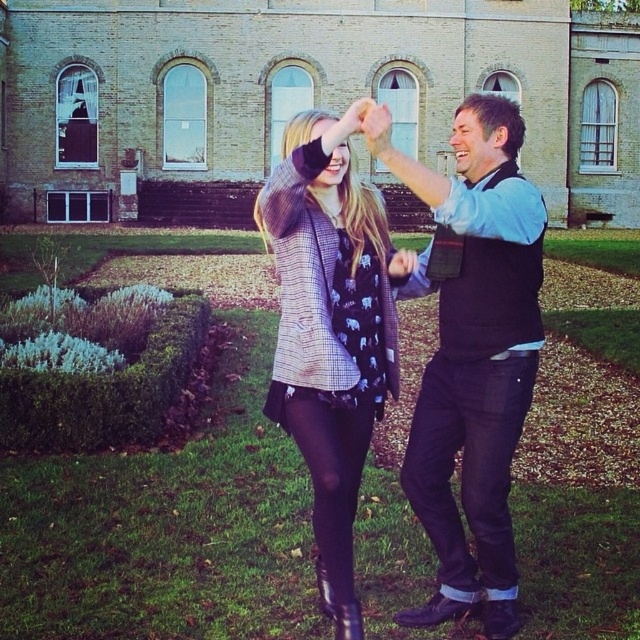
You are a tailor observing two garments displayed on mannequins in the center of a lawn. The garments are the black matte vest at center and the plaid woolen jacket at center. Which garment has a wider width?

The black matte vest at center has a larger width than the plaid woolen jacket at center according to the description.

You are a photographer trying to capture the two people in the scene. You need to know their positions relative to each other to frame the shot properly. Which object is on the left side when looking at the black matte vest at center and the plaid woolen jacket at center?

The plaid woolen jacket at center is on the left side of the black matte vest at center.

Consider the image. You are standing at the point marked as point (440,576) in the image and want to take a photo of the historic building with arched windows. Considering the distance, will you need to zoom in your camera to capture the building clearly?

The distance of point (440,576) from viewer is 20.78 meters. To capture the historic building with arched windows clearly from that distance, you would likely need to zoom in your camera to ensure the building fills the frame appropriately.